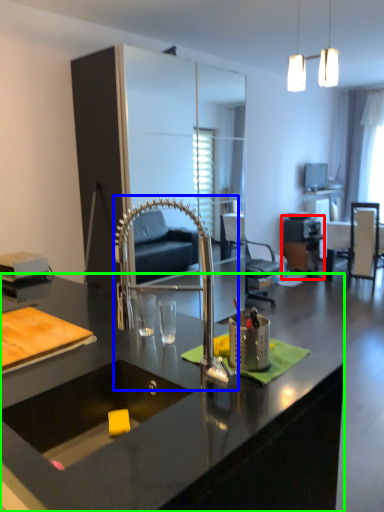
Question: Which object is positioned closest to computer desk (highlighted by a red box)? Select from faucet (highlighted by a blue box) and desk (highlighted by a green box).

Choices:
 (A) faucet
 (B) desk

Answer: (A)